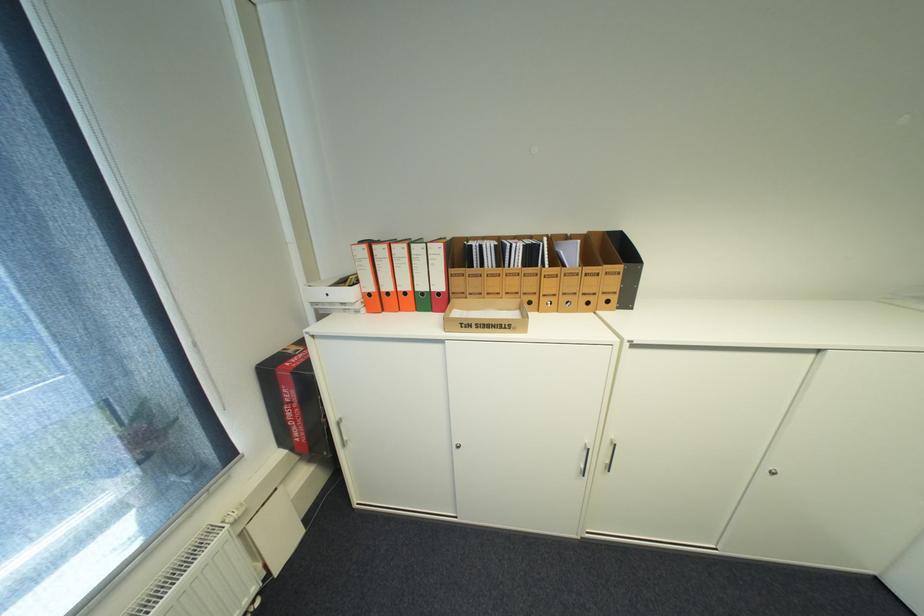
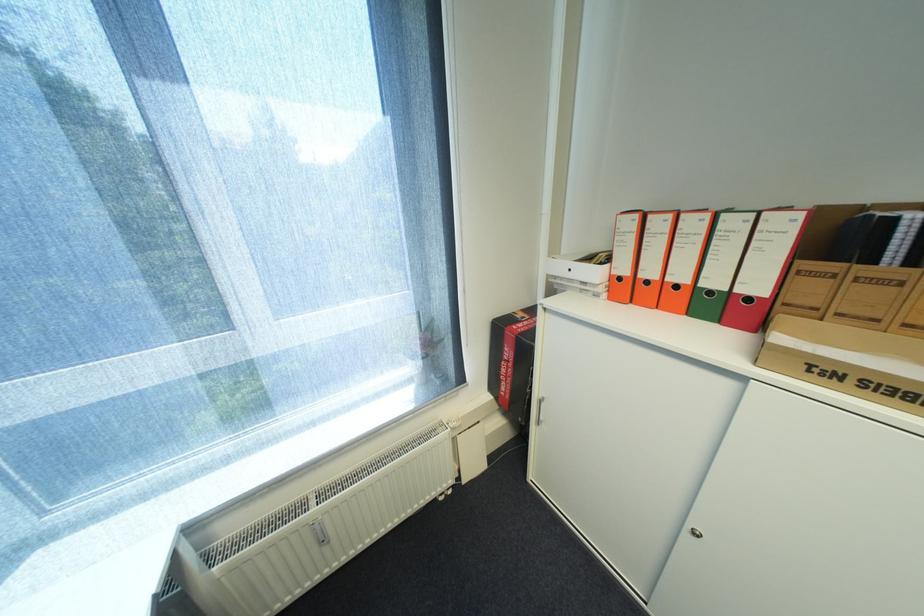
Find the pixel in the second image that matches (420,253) in the first image.

(727, 227)